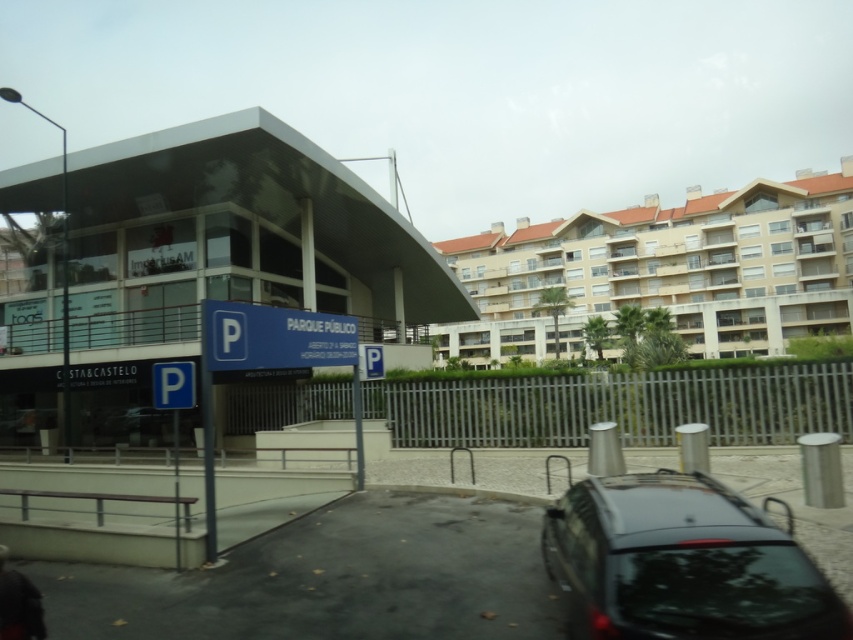
Does transparent glass building at center have a smaller size compared to blue metallic sign at center?

No.

Which is behind, point (91, 189) or point (303, 326)?

Point (91, 189)

You are a GUI agent. You are given a task and a screenshot of the screen. Output one action in this format:
    pyautogui.click(x=<x>, y=<y>)
    Task: Click on the transparent glass building at center
    This screenshot has width=853, height=640.
    Given the screenshot: What is the action you would take?
    pyautogui.click(x=225, y=256)

Where is `transparent glass building at center`? The image size is (853, 640). transparent glass building at center is located at coordinates (225, 256).

Who is taller, shiny black car at lower right or blue plastic parking sign at center?

blue plastic parking sign at center

Who is more distant from viewer, (726, 518) or (183, 404)?

The point (183, 404) is more distant.

Between point (561, 525) and point (194, 387), which one is positioned in front?

Point (561, 525) is in front.

Where is `shiny black car at lower right`? This screenshot has width=853, height=640. shiny black car at lower right is located at coordinates (682, 563).

Can you confirm if transparent glass building at center is smaller than blue plastic parking sign at center?

Actually, transparent glass building at center might be larger than blue plastic parking sign at center.

Between point (376, 221) and point (178, 381), which one is positioned in front?

Positioned in front is point (178, 381).

The width and height of the screenshot is (853, 640). Identify the location of transparent glass building at center. (225, 256).